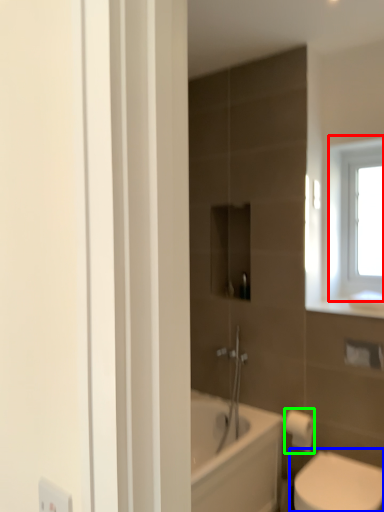
Question: Which object is the closest to the window (highlighted by a red box)? Choose among these: toilet (highlighted by a blue box) or toilet paper (highlighted by a green box).

Choices:
 (A) toilet
 (B) toilet paper

Answer: (B)